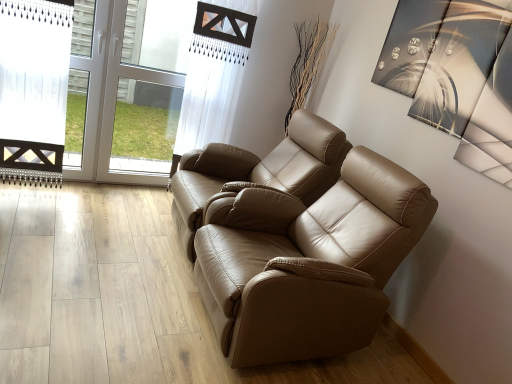
Question: Should I look upward or downward to see tan leather sofa at center, which is the 1th chair from front to back?

Choices:
 (A) down
 (B) up

Answer: (A)

Question: Is tan leather sofa at center, the first chair when ordered from back to front, at the left side of transparent glass door at upper left?

Choices:
 (A) yes
 (B) no

Answer: (B)

Question: Can you confirm if tan leather sofa at center, arranged as the second chair when viewed from the front, is shorter than transparent glass door at upper left?

Choices:
 (A) no
 (B) yes

Answer: (B)

Question: From the image's perspective, does tan leather sofa at center, the first chair when ordered from back to front, appear lower than transparent glass door at upper left?

Choices:
 (A) yes
 (B) no

Answer: (A)

Question: From a real-world perspective, is tan leather sofa at center, arranged as the second chair when viewed from the front, positioned over transparent glass door at upper left based on gravity?

Choices:
 (A) no
 (B) yes

Answer: (A)

Question: From a real-world perspective, is tan leather sofa at center, the first chair when ordered from back to front, under transparent glass door at upper left?

Choices:
 (A) no
 (B) yes

Answer: (B)

Question: Is tan leather sofa at center, arranged as the second chair when viewed from the front, positioned in front of transparent glass door at upper left?

Choices:
 (A) no
 (B) yes

Answer: (B)

Question: Considering the relative sizes of tan leather sofa at center, arranged as the second chair when viewed from the front, and tan leather sofa at center, which is the 1th chair from front to back, in the image provided, is tan leather sofa at center, arranged as the second chair when viewed from the front, smaller than tan leather sofa at center, which is the 1th chair from front to back,?

Choices:
 (A) yes
 (B) no

Answer: (A)

Question: Is tan leather sofa at center, which is the second chair in back-to-front order, located within tan leather sofa at center, the first chair when ordered from back to front?

Choices:
 (A) yes
 (B) no

Answer: (B)

Question: Considering the relative sizes of tan leather sofa at center, the first chair when ordered from back to front, and tan leather sofa at center, which is the 1th chair from front to back, in the image provided, is tan leather sofa at center, the first chair when ordered from back to front, shorter than tan leather sofa at center, which is the 1th chair from front to back,?

Choices:
 (A) no
 (B) yes

Answer: (B)

Question: Is tan leather sofa at center, which is the 1th chair from front to back, at the back of tan leather sofa at center, the first chair when ordered from back to front?

Choices:
 (A) yes
 (B) no

Answer: (B)

Question: From a real-world perspective, is tan leather sofa at center, the first chair when ordered from back to front, positioned over tan leather sofa at center, which is the second chair in back-to-front order, based on gravity?

Choices:
 (A) no
 (B) yes

Answer: (B)

Question: Is the position of tan leather sofa at center, the first chair when ordered from back to front, less distant than that of tan leather sofa at center, which is the 1th chair from front to back?

Choices:
 (A) yes
 (B) no

Answer: (B)

Question: Does tan leather sofa at center, which is the 1th chair from front to back, have a greater height compared to tan leather sofa at center, arranged as the second chair when viewed from the front?

Choices:
 (A) no
 (B) yes

Answer: (B)